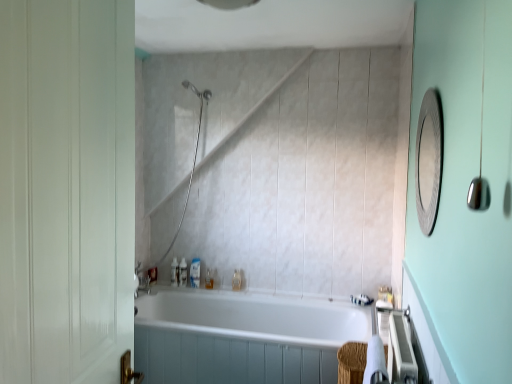
Looking at this image, measure the distance between point [174,285] and camera.

They are 3.18 meters apart.

Measure the distance between translucent plastic soap at lower right, placed as the first toiletry when sorted from right to left, and camera.

The depth of translucent plastic soap at lower right, placed as the first toiletry when sorted from right to left, is 2.79 meters.

The height and width of the screenshot is (384, 512). I want to click on translucent plastic bottle at lower center, arranged as the 2th toiletry when viewed from the right, so click(x=236, y=280).

How much space does translucent plastic bottle at lower left, arranged as the seventh toiletry when viewed from the right, occupy vertically?

The height of translucent plastic bottle at lower left, arranged as the seventh toiletry when viewed from the right, is 5.17 inches.

What do you see at coordinates (152, 274) in the screenshot? This screenshot has height=384, width=512. I see `translucent plastic bottle at lower left, arranged as the seventh toiletry when viewed from the right` at bounding box center [152, 274].

Describe the element at coordinates (195, 273) in the screenshot. I see `translucent plastic soap dispenser at center, the 4th toiletry positioned from the right` at that location.

What are the coordinates of `translucent plastic soap at upper left, which is the sixth toiletry from right to left` in the screenshot? It's located at (175, 272).

From the image's perspective, relative to translucent plastic soap at lower center, the third toiletry from the right, is translucent plastic soap at upper left, which is the sixth toiletry from right to left, above or below?

translucent plastic soap at upper left, which is the sixth toiletry from right to left, is situated higher than translucent plastic soap at lower center, the third toiletry from the right, in the image.

Is point (178, 270) closer to viewer compared to point (208, 275)?

That is False.

Based on their positions, is translucent plastic soap at upper left, which is the sixth toiletry from right to left, located to the left or right of translucent plastic soap at lower center, the third toiletry from the right?

translucent plastic soap at upper left, which is the sixth toiletry from right to left, is positioned on translucent plastic soap at lower center, the third toiletry from the right,'s left side.

Can you tell me how much translucent plastic soap at upper left, which is the sixth toiletry from right to left, and translucent plastic soap at lower center, the third toiletry from the right, differ in facing direction?

0.00503 degrees.

From the image's perspective, is translucent plastic bottle at lower center, the fifth toiletry viewed from the right, above translucent plastic bottle at lower left, which is counted as the first toiletry, starting from the left?

Yes, from the image's perspective, translucent plastic bottle at lower center, the fifth toiletry viewed from the right, is over translucent plastic bottle at lower left, which is counted as the first toiletry, starting from the left.

Is translucent plastic bottle at lower center, the fifth toiletry viewed from the right, smaller than translucent plastic bottle at lower left, which is counted as the first toiletry, starting from the left?

No, translucent plastic bottle at lower center, the fifth toiletry viewed from the right, is not smaller than translucent plastic bottle at lower left, which is counted as the first toiletry, starting from the left.

From a real-world perspective, between translucent plastic bottle at lower center, the fifth toiletry viewed from the right, and translucent plastic bottle at lower left, which is counted as the first toiletry, starting from the left, who is vertically lower?

translucent plastic bottle at lower left, which is counted as the first toiletry, starting from the left, from a real-world perspective.

Which is farther from the camera, (196,279) or (30,128)?

The point (196,279) is more distant.

From the image's perspective, is translucent plastic soap dispenser at center, the fourth toiletry positioned from the left, positioned above or below white matte door at left?

From the image's perspective, translucent plastic soap dispenser at center, the fourth toiletry positioned from the left, appears below white matte door at left.

How many degrees apart are the facing directions of translucent plastic soap dispenser at center, the 4th toiletry positioned from the right, and white matte door at left?

They differ by 96.8 degrees in their facing directions.

In terms of height, does translucent plastic soap dispenser at center, the fourth toiletry positioned from the left, look taller or shorter compared to white matte door at left?

translucent plastic soap dispenser at center, the fourth toiletry positioned from the left, is shorter than white matte door at left.

Which of these two, metallic textured mirror at upper right or translucent plastic soap at upper left, which is the sixth toiletry from right to left, stands shorter?

translucent plastic soap at upper left, which is the sixth toiletry from right to left, is shorter.

Does point (424, 121) lie in front of point (170, 277)?

That is True.

Looking at this image, from the image's perspective, does metallic textured mirror at upper right appear lower than translucent plastic soap at upper left, which is the sixth toiletry from right to left?

No, from the image's perspective, metallic textured mirror at upper right is not below translucent plastic soap at upper left, which is the sixth toiletry from right to left.

From a real-world perspective, is metallic textured mirror at upper right physically located above or below translucent plastic soap at upper left, acting as the second toiletry starting from the left?

In terms of real-world spatial position, metallic textured mirror at upper right is above translucent plastic soap at upper left, acting as the second toiletry starting from the left.

Measure the distance from translucent plastic bottle at lower center, the fifth toiletry viewed from the right, to white glossy bathtub at center.

translucent plastic bottle at lower center, the fifth toiletry viewed from the right, and white glossy bathtub at center are 30.88 inches apart from each other.

Is translucent plastic bottle at lower center, the fifth toiletry viewed from the right, located outside white glossy bathtub at center?

Indeed, translucent plastic bottle at lower center, the fifth toiletry viewed from the right, is completely outside white glossy bathtub at center.

Which is in front, translucent plastic bottle at lower center, marked as the 3th toiletry in a left-to-right arrangement, or white glossy bathtub at center?

Positioned in front is white glossy bathtub at center.

Are translucent plastic bottle at lower center, marked as the 3th toiletry in a left-to-right arrangement, and white glossy bathtub at center making contact?

There is a gap between translucent plastic bottle at lower center, marked as the 3th toiletry in a left-to-right arrangement, and white glossy bathtub at center.

From a real-world perspective, is metallic textured mirror at upper right above or below satin nickel showerhead at upper center?

From a real-world perspective, metallic textured mirror at upper right is physically above satin nickel showerhead at upper center.

From the picture: Does metallic textured mirror at upper right appear on the left side of satin nickel showerhead at upper center?

In fact, metallic textured mirror at upper right is to the right of satin nickel showerhead at upper center.

Is metallic textured mirror at upper right aimed at satin nickel showerhead at upper center?

No, metallic textured mirror at upper right is not facing towards satin nickel showerhead at upper center.

Consider the image. From the image's perspective, is metallic textured mirror at upper right beneath satin nickel showerhead at upper center?

Incorrect, from the image's perspective, metallic textured mirror at upper right is higher than satin nickel showerhead at upper center.

Is point (80, 99) in front of point (208, 286)?

That is True.

In the scene shown: Considering the relative sizes of white matte door at left and translucent plastic soap at lower center, the third toiletry from the right, in the image provided, is white matte door at left bigger than translucent plastic soap at lower center, the third toiletry from the right,?

Correct, white matte door at left is larger in size than translucent plastic soap at lower center, the third toiletry from the right.

Is white matte door at left not inside translucent plastic soap at lower center, the third toiletry from the right?

white matte door at left is positioned outside translucent plastic soap at lower center, the third toiletry from the right.

Which toiletry is the 3rd one when counting from the back of the translucent plastic soap at lower center, the third toiletry from the right? Please provide its 2D coordinates.

[(175, 272)]

The width and height of the screenshot is (512, 384). What are the coordinates of `the 4th toiletry located above the translucent plastic bottle at lower left, which is counted as the first toiletry, starting from the left (from a real-world perspective)` in the screenshot? It's located at (183, 272).

Considering their positions, is translucent plastic bottle at lower center, marked as the 3th toiletry in a left-to-right arrangement, positioned further to translucent plastic soap at upper left, acting as the second toiletry starting from the left, than translucent plastic soap at lower center, the third toiletry from the right?

translucent plastic soap at lower center, the third toiletry from the right, lies further to translucent plastic soap at upper left, acting as the second toiletry starting from the left, than the other object.

When comparing their distances from translucent plastic bottle at lower left, which is counted as the first toiletry, starting from the left, does translucent plastic bottle at lower center, the fifth toiletry viewed from the right, or translucent plastic bottle at lower center, arranged as the 2th toiletry when viewed from the right, seem further?

translucent plastic bottle at lower center, arranged as the 2th toiletry when viewed from the right.

Based on their spatial positions, is translucent plastic soap dispenser at center, the fourth toiletry positioned from the left, or translucent plastic soap at upper left, acting as the second toiletry starting from the left, closer to translucent plastic bottle at lower center, the fifth toiletry viewed from the right?

translucent plastic soap at upper left, acting as the second toiletry starting from the left, lies closer to translucent plastic bottle at lower center, the fifth toiletry viewed from the right, than the other object.

From the image, which object appears to be nearer to satin nickel showerhead at upper center, white matte door at left or metallic textured mirror at upper right?

metallic textured mirror at upper right is positioned closer to the anchor satin nickel showerhead at upper center.

Considering their positions, is satin nickel showerhead at upper center positioned closer to white glossy bathtub at center than translucent plastic soap dispenser at center, the 4th toiletry positioned from the right?

The object closer to white glossy bathtub at center is translucent plastic soap dispenser at center, the 4th toiletry positioned from the right.

When comparing their distances from white glossy bathtub at center, does satin nickel showerhead at upper center or translucent plastic soap at upper left, which is the sixth toiletry from right to left, seem further?

Among the two, satin nickel showerhead at upper center is located further to white glossy bathtub at center.

Estimate the real-world distances between objects in this image. Which object is closer to translucent plastic soap at lower center, the third toiletry from the right, satin nickel showerhead at upper center or translucent plastic soap dispenser at center, the 4th toiletry positioned from the right?

translucent plastic soap dispenser at center, the 4th toiletry positioned from the right.

From the image, which object appears to be nearer to white glossy bathtub at center, translucent plastic bottle at lower left, which is counted as the first toiletry, starting from the left, or translucent plastic soap dispenser at center, the fourth toiletry positioned from the left?

The object closer to white glossy bathtub at center is translucent plastic soap dispenser at center, the fourth toiletry positioned from the left.

Identify the location of bathtub between metallic textured mirror at upper right and translucent plastic bottle at lower center, arranged as the 2th toiletry when viewed from the right, from front to back. pos(242,337).

Where is `bathtub between metallic textured mirror at upper right and translucent plastic soap dispenser at center, the 4th toiletry positioned from the right, from front to back`? This screenshot has width=512, height=384. bathtub between metallic textured mirror at upper right and translucent plastic soap dispenser at center, the 4th toiletry positioned from the right, from front to back is located at coordinates (242, 337).

This screenshot has height=384, width=512. I want to click on shower between metallic textured mirror at upper right and translucent plastic bottle at lower center, the fifth toiletry viewed from the right, from front to back, so click(x=193, y=159).

Locate an element on the screen. toiletry between translucent plastic soap at upper left, which is the sixth toiletry from right to left, and translucent plastic soap dispenser at center, the fourth toiletry positioned from the left, in the horizontal direction is located at coordinates (183, 272).